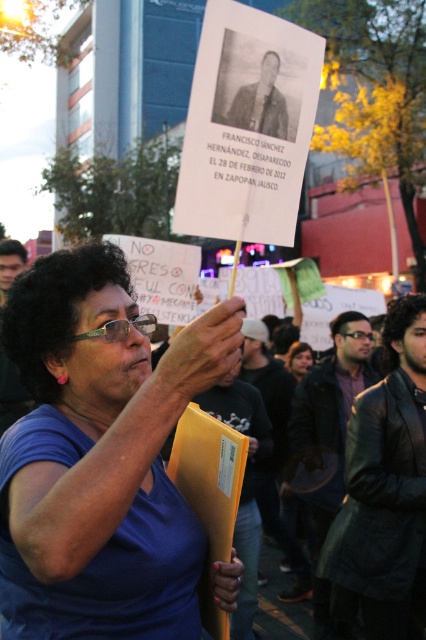
You are a photographer trying to capture a clear shot of the sign held by the woman in the protest scene. The leather jacket at center and the yellow paper folder at center are blocking your view. Which object should you move to get a better view of the sign?

The leather jacket at center occupies less space than the yellow paper folder at center, so moving the yellow paper folder at center would allow for a clearer view of the sign since it takes up more space and is blocking more of the view.

You are a journalist documenting the protest scene. You notice two prominent features at the center of the image. Which one is bigger in size between the black leather jacket at center and the blonde hair at center?

The black leather jacket at center is larger in size than the blonde hair at center.